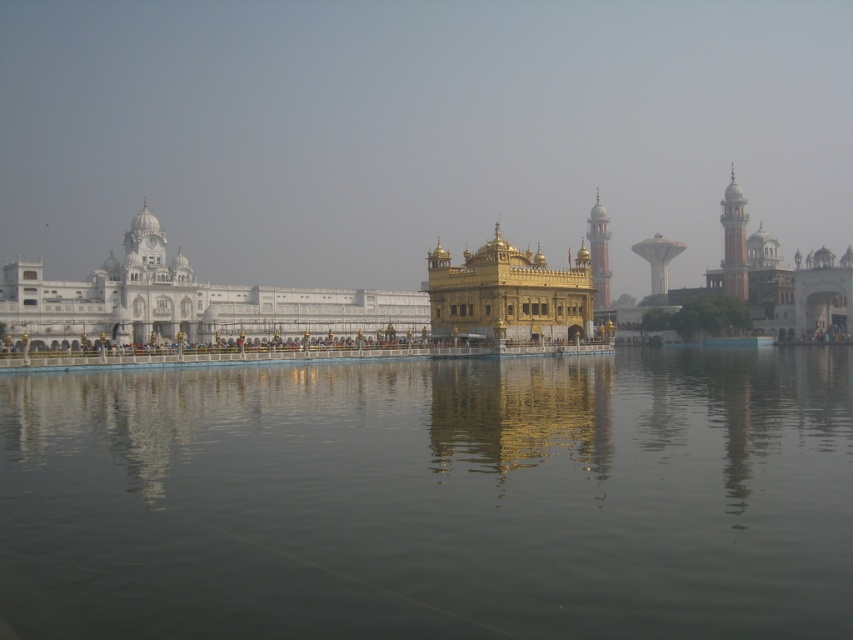
Question: Which of the following is the farthest from the observer?

Choices:
 (A) transparent water at center
 (B) golden polished temple at center

Answer: (B)

Question: Is transparent water at center wider than golden polished temple at center?

Choices:
 (A) no
 (B) yes

Answer: (A)

Question: Considering the relative positions of transparent water at center and golden polished temple at center in the image provided, where is transparent water at center located with respect to golden polished temple at center?

Choices:
 (A) right
 (B) left

Answer: (B)

Question: Can you confirm if transparent water at center is thinner than golden polished temple at center?

Choices:
 (A) no
 (B) yes

Answer: (B)